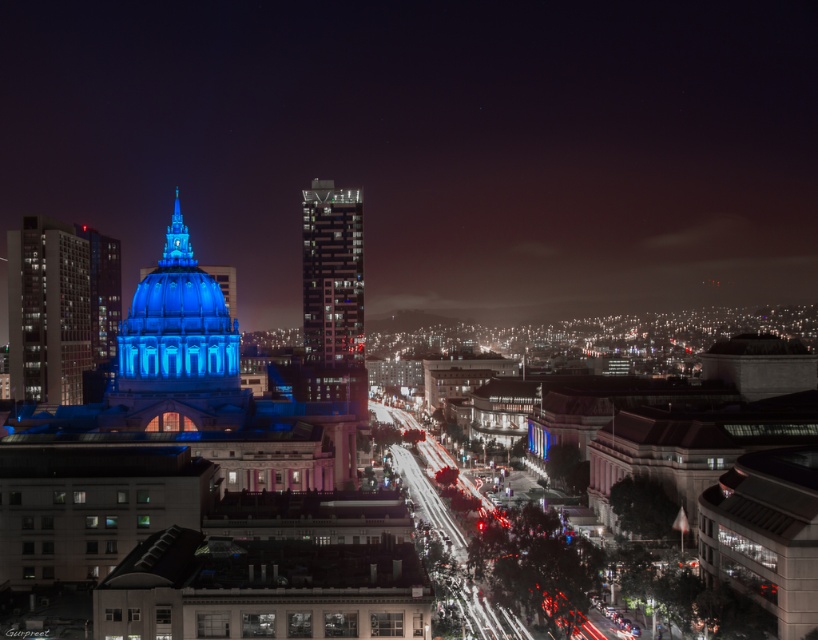
You are standing in the city and looking at the grand building with a prominent dome. There are two points of interest marked on the ground in front of you. The first point is at coordinates point (212, 358), and the second is at point (311, 234). Which point is closer to you?

Point (212, 358) is closer to the viewer than point (311, 234).

You are a drone operator tasked with capturing aerial footage of the city. Your drone has a maximum flight range of 80 meters from its starting position. If you start at the blue glass dome at center, can you fly your drone to the glassy reflective skyscraper at center without exceeding its range?

The blue glass dome at center is 84.69 meters from the glassy reflective skyscraper at center. Since the drone has a maximum range of 80 meters, it cannot reach the glassy reflective skyscraper at center from the blue glass dome at center without exceeding its range.